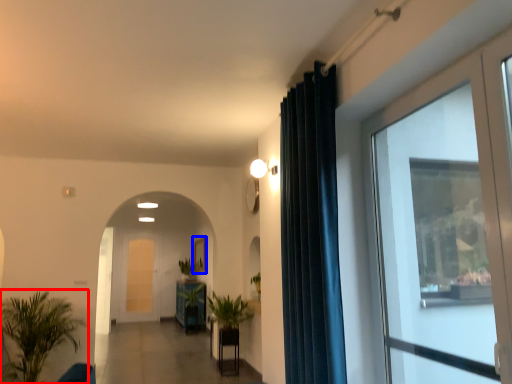
Question: Which object is further to the camera taking this photo, houseplant (highlighted by a red box) or picture frame (highlighted by a blue box)?

Choices:
 (A) houseplant
 (B) picture frame

Answer: (B)